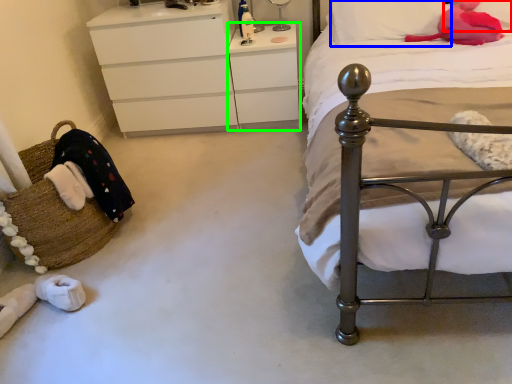
Question: Which object is positioned farthest from pillow (highlighted by a red box)? Select from pillow (highlighted by a blue box) and changing table (highlighted by a green box).

Choices:
 (A) pillow
 (B) changing table

Answer: (B)